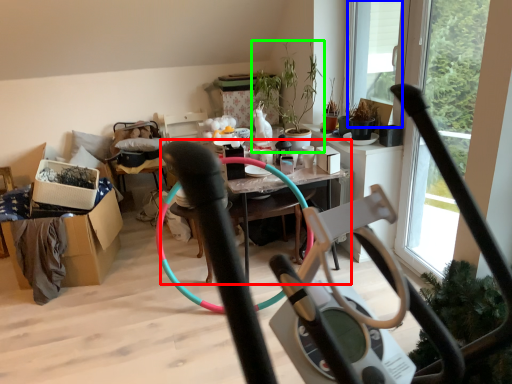
Question: Which object is the closest to the table (highlighted by a red box)? Choose among these: window screen (highlighted by a blue box) or houseplant (highlighted by a green box).

Choices:
 (A) window screen
 (B) houseplant

Answer: (B)